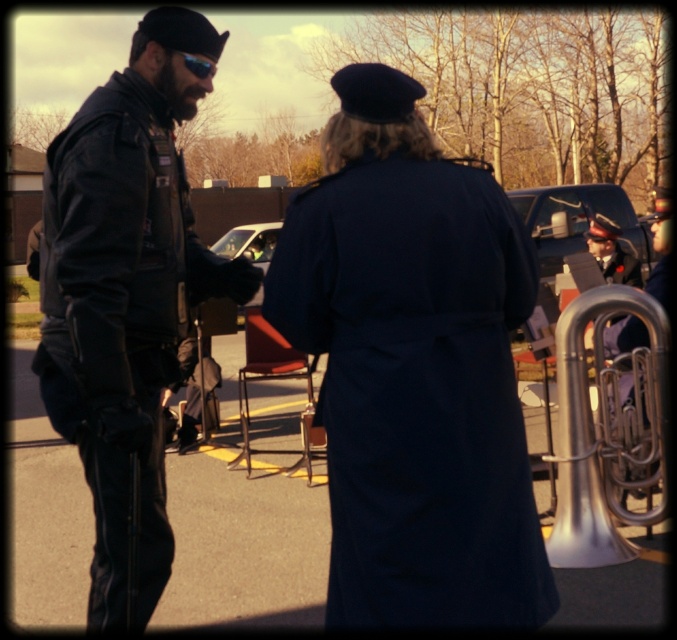
Who is higher up, navy wool coat at center or leather jacket at left?

leather jacket at left is above.

Does point (345, 461) lie behind point (127, 403)?

No, (345, 461) is closer to viewer.

Locate an element on the screen. The height and width of the screenshot is (640, 677). navy wool coat at center is located at coordinates (416, 390).

Is leather jacket at left taller than silver metallic tuba at lower right?

Correct, leather jacket at left is much taller as silver metallic tuba at lower right.

Where is `leather jacket at left`? The width and height of the screenshot is (677, 640). leather jacket at left is located at coordinates (127, 298).

I want to click on navy wool coat at center, so click(416, 390).

Based on the photo, is navy wool coat at center thinner than silver metallic tuba at lower right?

In fact, navy wool coat at center might be wider than silver metallic tuba at lower right.

Who is more forward, [443,417] or [586,428]?

Point [443,417] is more forward.

In order to click on navy wool coat at center in this screenshot , I will do `click(416, 390)`.